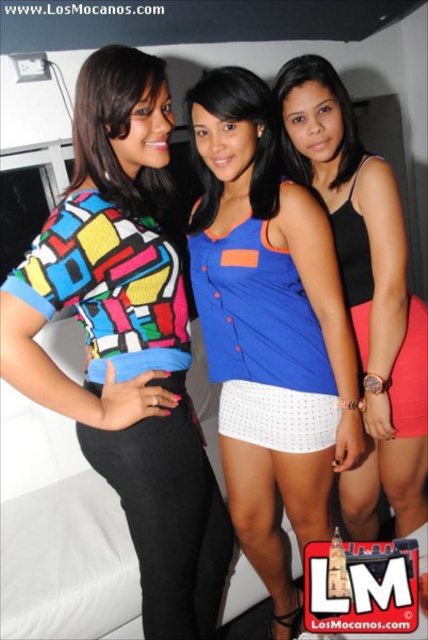
Question: Is multicolored knitted sweater at center wider than black matte tank top at center?

Choices:
 (A) no
 (B) yes

Answer: (A)

Question: Which point appears closest to the camera in this image?

Choices:
 (A) (193, 218)
 (B) (142, 604)
 (C) (339, 340)
 (D) (160, 102)

Answer: (D)

Question: Is multicolored knitted sweater at center wider than blue fabric top at center?

Choices:
 (A) yes
 (B) no

Answer: (B)

Question: Is multicolored knitted sweater at center thinner than multicolored fabric blouse at center?

Choices:
 (A) yes
 (B) no

Answer: (B)

Question: Which point is closer to the camera?

Choices:
 (A) (401, 500)
 (B) (103, 412)
 (C) (243, 116)

Answer: (B)

Question: Among these objects, which one is nearest to the camera?

Choices:
 (A) multicolored fabric blouse at center
 (B) blue fabric top at center
 (C) blue fabric blouse at center
 (D) multicolored knitted sweater at center

Answer: (D)